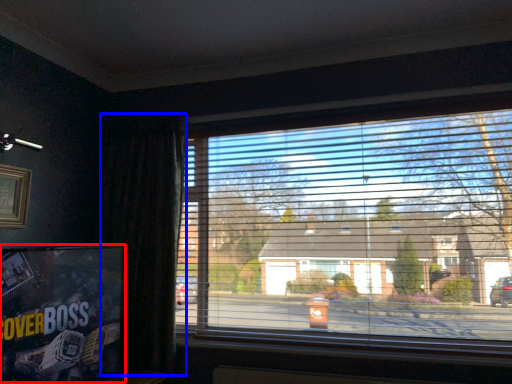
Question: Which object appears farthest to the camera in this image, tv show (highlighted by a red box) or curtain (highlighted by a blue box)?

Choices:
 (A) tv show
 (B) curtain

Answer: (B)